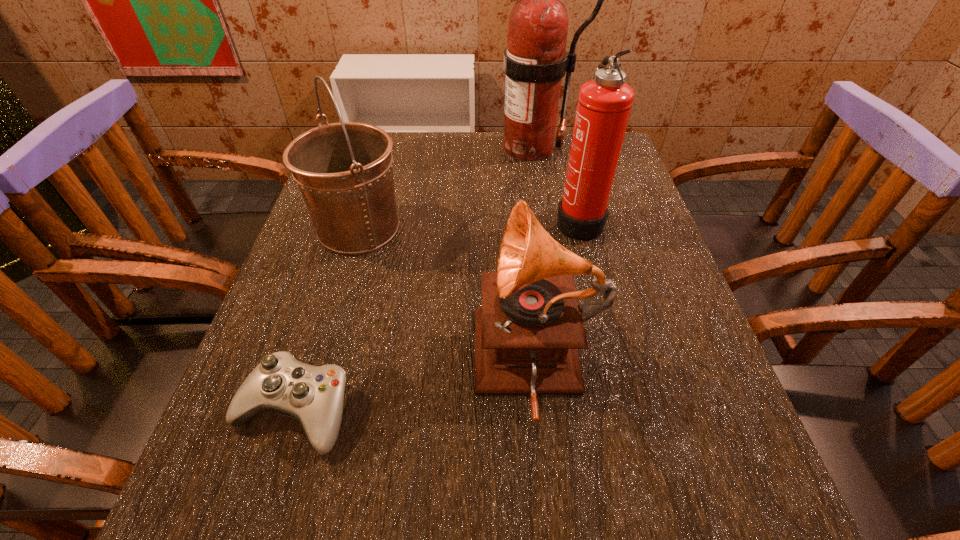
This screenshot has width=960, height=540. Identify the location of free space between the bucket and the phonograph record. (448, 297).

Locate an element on the screen. Image resolution: width=960 pixels, height=540 pixels. free space that is in between the shortest object and the farther fire extinguisher is located at coordinates (411, 279).

This screenshot has width=960, height=540. What are the coordinates of `unoccupied position between the tallest object and the bucket` in the screenshot? It's located at (444, 188).

Where is `free area in between the bucket and the tallest object`? This screenshot has height=540, width=960. free area in between the bucket and the tallest object is located at coordinates (444, 188).

Identify the location of free spot between the bucket and the phonograph record. The height and width of the screenshot is (540, 960). (448, 297).

The image size is (960, 540). Identify the location of vacant space that's between the bucket and the phonograph record. (448, 297).

You are a GUI agent. You are given a task and a screenshot of the screen. Output one action in this format:
    pyautogui.click(x=<x>, y=<y>)
    Task: Click on the second closest object to the shorter fire extinguisher
    Image resolution: width=960 pixels, height=540 pixels.
    Given the screenshot: What is the action you would take?
    pyautogui.click(x=528, y=331)

What are the coordinates of `object that is the third closest one to the bucket` in the screenshot? It's located at (313, 395).

Where is `free space that satisfies the following two spatial constraints: 1. at the nozzle of the farther fire extinguisher; 2. on the front side of the control`? free space that satisfies the following two spatial constraints: 1. at the nozzle of the farther fire extinguisher; 2. on the front side of the control is located at coordinates (568, 410).

This screenshot has width=960, height=540. Find the location of `vacant space that satisfies the following two spatial constraints: 1. on the horn of the phonograph record; 2. on the front side of the control`. vacant space that satisfies the following two spatial constraints: 1. on the horn of the phonograph record; 2. on the front side of the control is located at coordinates (542, 410).